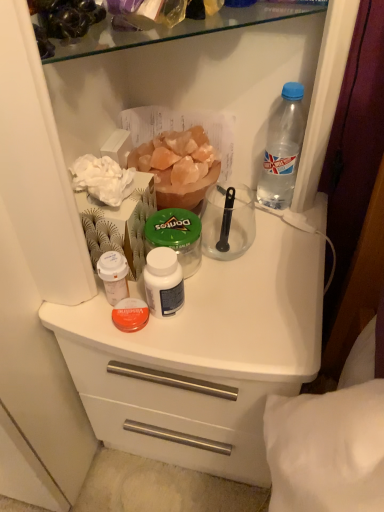
At what (x,y) coordinates should I click in order to perform the action: click on free space to the right of orange crystal salt at center. Please return your answer as a coordinate pair (x, y). Looking at the image, I should click on (261, 221).